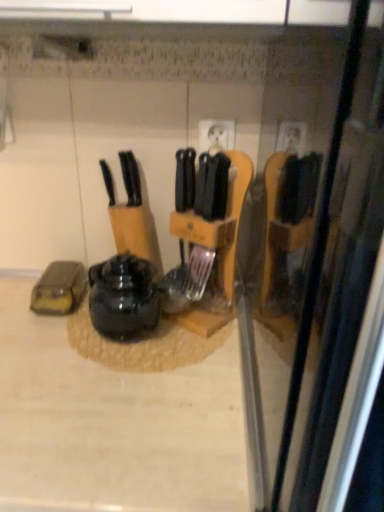
Identify the location of empty space that is ontop of beige laminate counter at center (from a real-world perspective). (86, 372).